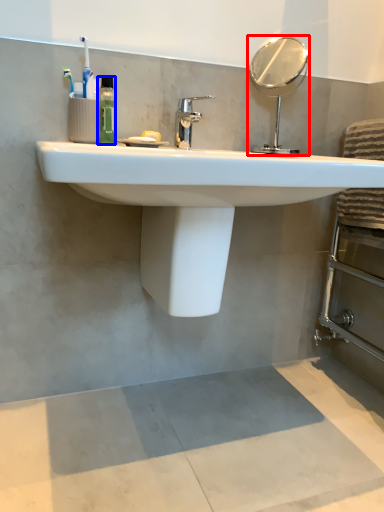
Question: Which object is closer to the camera taking this photo, mirror (highlighted by a red box) or mouthwash (highlighted by a blue box)?

Choices:
 (A) mirror
 (B) mouthwash

Answer: (B)